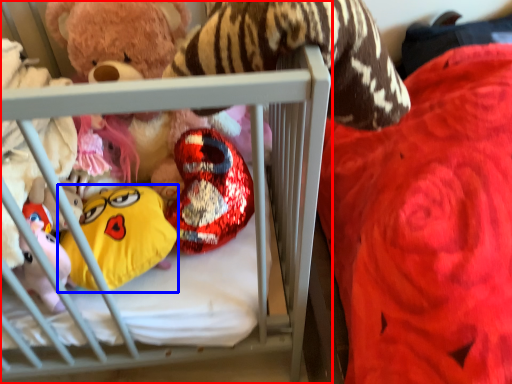
Question: Which object appears farthest to the camera in this image, infant bed (highlighted by a red box) or toy (highlighted by a blue box)?

Choices:
 (A) infant bed
 (B) toy

Answer: (B)